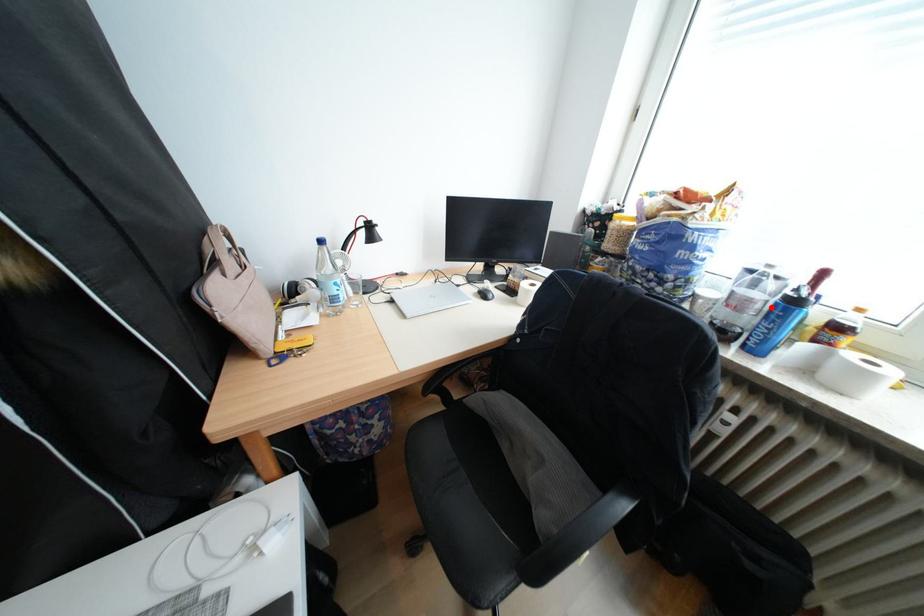
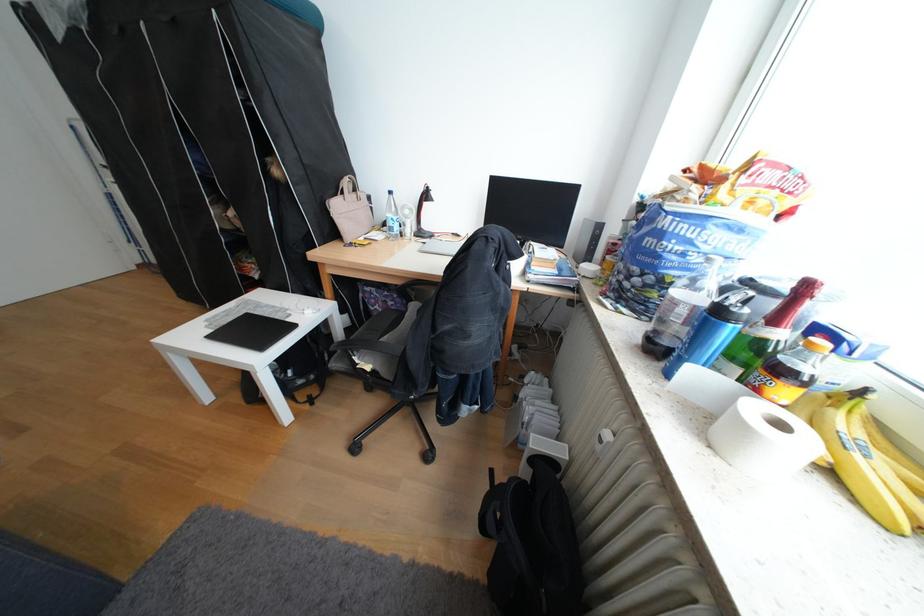
The point at the highlighted location is marked in the first image. Where is the corresponding point in the second image?

(695, 312)